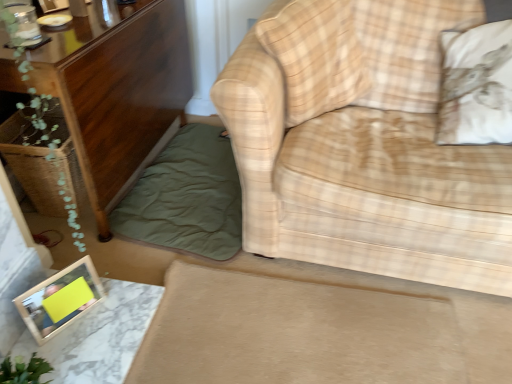
What do you see at coordinates (41, 122) in the screenshot? I see `green leafy plant at left` at bounding box center [41, 122].

The height and width of the screenshot is (384, 512). I want to click on green cotton blanket at lower left, so click(x=186, y=197).

Describe the element at coordinates (477, 86) in the screenshot. I see `white cotton pillow at upper right, arranged as the second pillow when viewed from the left` at that location.

The image size is (512, 384). What do you see at coordinates (60, 299) in the screenshot?
I see `wooden picture frame at lower left` at bounding box center [60, 299].

In order to face wooden cabinet at left, should I rotate leftwards or rightwards?

Rotate left and turn 19.983 degrees.

This screenshot has height=384, width=512. What do you see at coordinates (117, 90) in the screenshot?
I see `wooden cabinet at left` at bounding box center [117, 90].

Where is `plaid fabric pillow at center, which ranks as the first pillow in left-to-right order`? This screenshot has width=512, height=384. plaid fabric pillow at center, which ranks as the first pillow in left-to-right order is located at coordinates (315, 55).

Identify the location of green leafy plant at left. This screenshot has width=512, height=384. (41, 122).

Considering the sizes of objects beige plaid fabric couch at right and plaid fabric pillow at center, the second pillow in the right-to-left sequence, in the image provided, who is wider, beige plaid fabric couch at right or plaid fabric pillow at center, the second pillow in the right-to-left sequence,?

beige plaid fabric couch at right is wider.

Can you confirm if beige plaid fabric couch at right is bigger than plaid fabric pillow at center, the second pillow in the right-to-left sequence?

Yes.

Is beige plaid fabric couch at right looking in the opposite direction of plaid fabric pillow at center, which ranks as the first pillow in left-to-right order?

Yes.

Consider the image. Considering the sizes of wooden cabinet at left and white cotton pillow at upper right, arranged as the second pillow when viewed from the left, in the image, is wooden cabinet at left taller or shorter than white cotton pillow at upper right, arranged as the second pillow when viewed from the left,?

wooden cabinet at left is taller than white cotton pillow at upper right, arranged as the second pillow when viewed from the left.

Considering the relative sizes of wooden cabinet at left and white cotton pillow at upper right, arranged as the second pillow when viewed from the left, in the image provided, is wooden cabinet at left smaller than white cotton pillow at upper right, arranged as the second pillow when viewed from the left,?

Incorrect, wooden cabinet at left is not smaller in size than white cotton pillow at upper right, arranged as the second pillow when viewed from the left.

From the image's perspective, which is below, wooden cabinet at left or white cotton pillow at upper right, which is counted as the first pillow, starting from the right?

white cotton pillow at upper right, which is counted as the first pillow, starting from the right.

From a real-world perspective, which is physically above, wooden cabinet at left or white cotton pillow at upper right, which is counted as the first pillow, starting from the right?

From a 3D spatial view, white cotton pillow at upper right, which is counted as the first pillow, starting from the right, is above.

Looking at this image, is plaid fabric pillow at center, which ranks as the first pillow in left-to-right order, taller or shorter than white cotton pillow at upper right, which is counted as the first pillow, starting from the right?

Considering their sizes, plaid fabric pillow at center, which ranks as the first pillow in left-to-right order, has more height than white cotton pillow at upper right, which is counted as the first pillow, starting from the right.

From the image's perspective, which is below, plaid fabric pillow at center, the second pillow in the right-to-left sequence, or white cotton pillow at upper right, which is counted as the first pillow, starting from the right?

From the image's view, white cotton pillow at upper right, which is counted as the first pillow, starting from the right, is below.

Can you confirm if plaid fabric pillow at center, the second pillow in the right-to-left sequence, is thinner than white cotton pillow at upper right, arranged as the second pillow when viewed from the left?

Yes.

In the scene shown: Are wooden picture frame at lower left and green leafy plant at left far apart?

No, wooden picture frame at lower left is in close proximity to green leafy plant at left.

At what (x,y) coordinates should I click in order to perform the action: click on picture frame directly beneath the green leafy plant at left (from a real-world perspective). Please return your answer as a coordinate pair (x, y). The width and height of the screenshot is (512, 384). Looking at the image, I should click on (60, 299).

Would you say green leafy plant at left is part of wooden picture frame at lower left's contents?

No, green leafy plant at left is located outside of wooden picture frame at lower left.

From a real-world perspective, is wooden picture frame at lower left positioned above or below green leafy plant at left?

wooden picture frame at lower left is situated lower than green leafy plant at left in the real world.

Considering the sizes of objects beige plaid fabric couch at right and wooden picture frame at lower left in the image provided, who is smaller, beige plaid fabric couch at right or wooden picture frame at lower left?

With smaller size is wooden picture frame at lower left.

Is the depth of beige plaid fabric couch at right greater than that of wooden picture frame at lower left?

No, it is in front of wooden picture frame at lower left.

From a real-world perspective, who is located higher, beige plaid fabric couch at right or wooden picture frame at lower left?

In real-world perspective, beige plaid fabric couch at right is above.

Can you see beige plaid fabric couch at right touching wooden picture frame at lower left?

There is a gap between beige plaid fabric couch at right and wooden picture frame at lower left.

Is green cotton blanket at lower left bigger or smaller than wooden picture frame at lower left?

green cotton blanket at lower left is bigger than wooden picture frame at lower left.

Which is behind, green cotton blanket at lower left or wooden picture frame at lower left?

green cotton blanket at lower left is behind.

How many degrees apart are the facing directions of green cotton blanket at lower left and wooden picture frame at lower left?

The angular difference between green cotton blanket at lower left and wooden picture frame at lower left is 65.4 degrees.

Choose the correct answer: Is green cotton blanket at lower left inside wooden picture frame at lower left or outside it?

green cotton blanket at lower left cannot be found inside wooden picture frame at lower left.

Does white cotton pillow at upper right, which is counted as the first pillow, starting from the right, have a greater width compared to wooden picture frame at lower left?

Yes, white cotton pillow at upper right, which is counted as the first pillow, starting from the right, is wider than wooden picture frame at lower left.

Is white cotton pillow at upper right, arranged as the second pillow when viewed from the left, turned away from wooden picture frame at lower left?

white cotton pillow at upper right, arranged as the second pillow when viewed from the left, does not have its back to wooden picture frame at lower left.

Are white cotton pillow at upper right, arranged as the second pillow when viewed from the left, and wooden picture frame at lower left located far from each other?

Yes, white cotton pillow at upper right, arranged as the second pillow when viewed from the left, and wooden picture frame at lower left are quite far apart.

From a real-world perspective, is white cotton pillow at upper right, arranged as the second pillow when viewed from the left, over wooden picture frame at lower left?

Yes, from a real-world perspective, white cotton pillow at upper right, arranged as the second pillow when viewed from the left, is above wooden picture frame at lower left.

In the image, there is a plaid fabric pillow at center, the second pillow in the right-to-left sequence. At what (x,y) coordinates should I click in order to perform the action: click on studio couch below it (from a real-world perspective). Please return your answer as a coordinate pair (x, y). The height and width of the screenshot is (384, 512). Looking at the image, I should click on (362, 145).

What are the coordinates of `pillow that is the 2nd one when counting rightward from the wooden cabinet at left` in the screenshot? It's located at (477, 86).

Which object lies nearer to the anchor point white cotton pillow at upper right, which is counted as the first pillow, starting from the right, green leafy plant at left or wooden cabinet at left?

The object closer to white cotton pillow at upper right, which is counted as the first pillow, starting from the right, is wooden cabinet at left.

Looking at the image, which one is located further to white cotton pillow at upper right, which is counted as the first pillow, starting from the right, green leafy plant at left or beige plaid fabric couch at right?

green leafy plant at left is further to white cotton pillow at upper right, which is counted as the first pillow, starting from the right.

Estimate the real-world distances between objects in this image. Which object is closer to wooden cabinet at left, green leafy plant at left or plaid fabric pillow at center, which ranks as the first pillow in left-to-right order?

The object closer to wooden cabinet at left is green leafy plant at left.

When comparing their distances from wooden picture frame at lower left, does wooden cabinet at left or white cotton pillow at upper right, which is counted as the first pillow, starting from the right, seem further?

white cotton pillow at upper right, which is counted as the first pillow, starting from the right, lies further to wooden picture frame at lower left than the other object.

Based on their spatial positions, is green leafy plant at left or plaid fabric pillow at center, which ranks as the first pillow in left-to-right order, further from white cotton pillow at upper right, arranged as the second pillow when viewed from the left?

The object further to white cotton pillow at upper right, arranged as the second pillow when viewed from the left, is green leafy plant at left.

Which object lies nearer to the anchor point green cotton blanket at lower left, wooden picture frame at lower left or wooden cabinet at left?

wooden cabinet at left is positioned closer to the anchor green cotton blanket at lower left.

From the picture: Looking at the image, which one is located further to plaid fabric pillow at center, which ranks as the first pillow in left-to-right order, green leafy plant at left or white cotton pillow at upper right, which is counted as the first pillow, starting from the right?

green leafy plant at left lies further to plaid fabric pillow at center, which ranks as the first pillow in left-to-right order, than the other object.

When comparing their distances from wooden cabinet at left, does plaid fabric pillow at center, which ranks as the first pillow in left-to-right order, or green cotton blanket at lower left seem further?

plaid fabric pillow at center, which ranks as the first pillow in left-to-right order, lies further to wooden cabinet at left than the other object.

Where is `bedding between green leafy plant at left and beige plaid fabric couch at right in the horizontal direction`? bedding between green leafy plant at left and beige plaid fabric couch at right in the horizontal direction is located at coordinates (186, 197).

Where is `bedding between wooden cabinet at left and beige plaid fabric couch at right from left to right`? bedding between wooden cabinet at left and beige plaid fabric couch at right from left to right is located at coordinates (186, 197).

Locate an element on the screen. bedding between wooden picture frame at lower left and white cotton pillow at upper right, which is counted as the first pillow, starting from the right is located at coordinates (186, 197).

Image resolution: width=512 pixels, height=384 pixels. I want to click on pillow located between green cotton blanket at lower left and white cotton pillow at upper right, which is counted as the first pillow, starting from the right, in the left-right direction, so click(x=315, y=55).